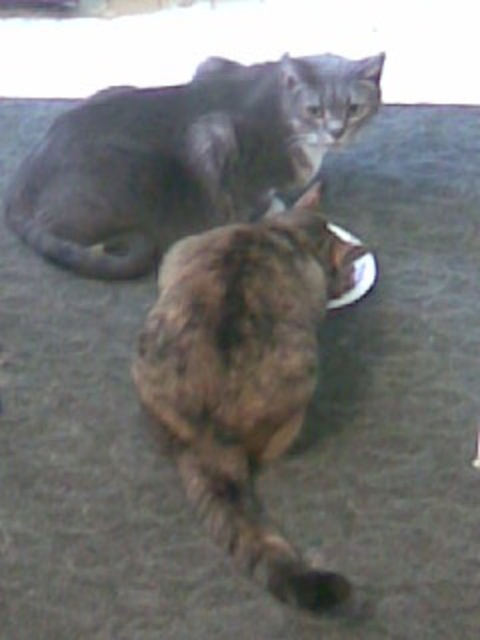
Who is shorter, gray fur cat at upper center or metallic reflective plate at center?

With less height is metallic reflective plate at center.

Is gray fur cat at upper center behind metallic reflective plate at center?

Yes, gray fur cat at upper center is further from the viewer.

Between point (187, 204) and point (355, 243), which one is positioned behind?

The point (355, 243) is more distant.

Where is `gray fur cat at upper center`? gray fur cat at upper center is located at coordinates click(x=183, y=157).

Between point (260, 380) and point (332, 221), which one is positioned behind?

The point (332, 221) is more distant.

Is point (219, 515) positioned before point (360, 259)?

Yes, point (219, 515) is closer to viewer.

This screenshot has width=480, height=640. Describe the element at coordinates (243, 374) in the screenshot. I see `brown fur cat at center` at that location.

You are a GUI agent. You are given a task and a screenshot of the screen. Output one action in this format:
    pyautogui.click(x=<x>, y=<y>)
    Task: Click on the brown fur cat at center
    The image size is (480, 640).
    Given the screenshot: What is the action you would take?
    pyautogui.click(x=243, y=374)

Does gray fur cat at upper center have a greater height compared to brown fur cat at center?

In fact, gray fur cat at upper center may be shorter than brown fur cat at center.

Locate an element on the screen. The width and height of the screenshot is (480, 640). gray fur cat at upper center is located at coordinates (183, 157).

Does point (379, 104) come behind point (244, 545)?

Yes, point (379, 104) is farther from viewer.

Where is `gray fur cat at upper center`? gray fur cat at upper center is located at coordinates (183, 157).